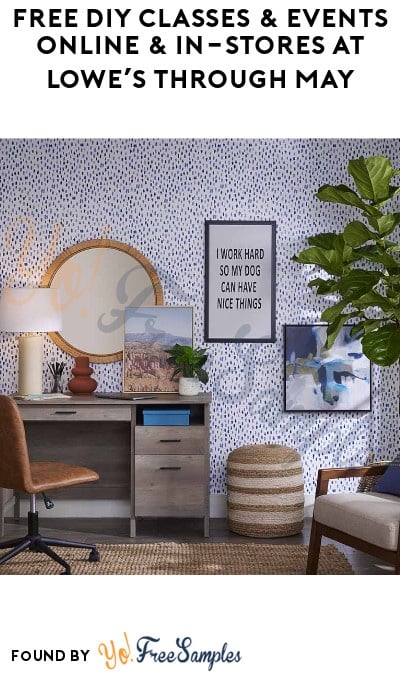
This screenshot has width=400, height=675. In order to click on plant in this screenshot , I will do `click(393, 348)`, `click(360, 284)`, `click(359, 235)`, `click(189, 360)`.